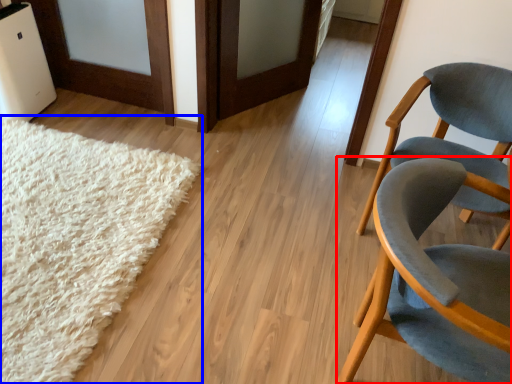
Question: Which point is further to the camera, chair (highlighted by a red box) or mat (highlighted by a blue box)?

Choices:
 (A) chair
 (B) mat

Answer: (B)